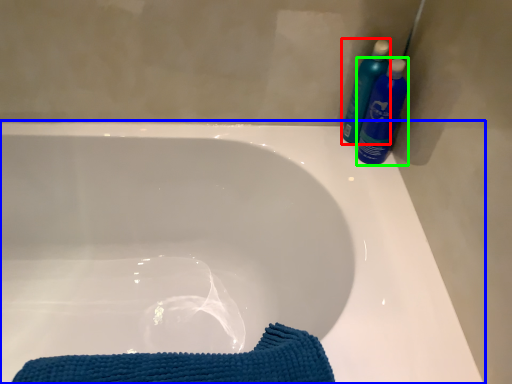
Question: Which is farther away from cleaning product (highlighted by a red box)? bathtub (highlighted by a blue box) or cleaning product (highlighted by a green box)?

Choices:
 (A) bathtub
 (B) cleaning product

Answer: (A)